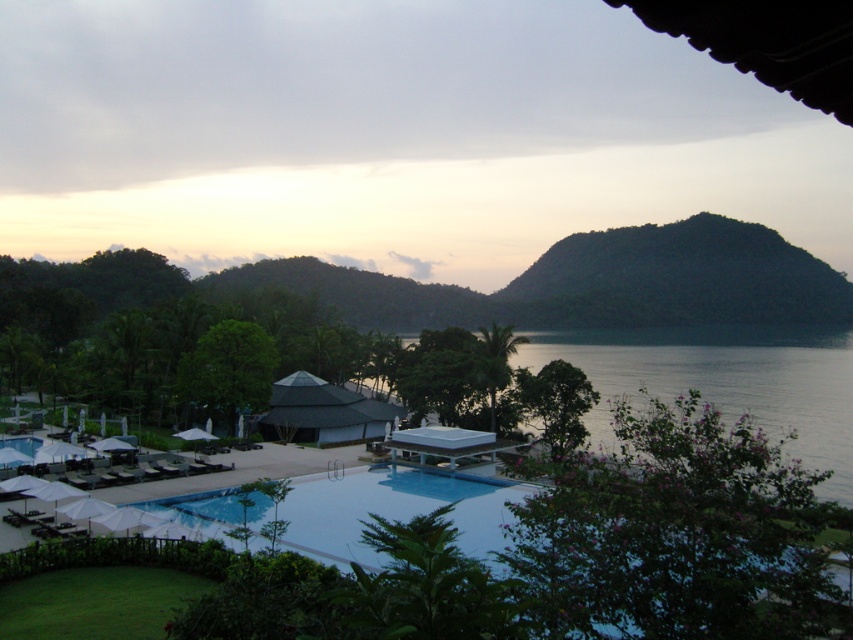
How distant is transparent glass pool at center from transparent glass water at center?

They are 82.93 meters apart.

Is transparent glass pool at center bigger than transparent glass water at center?

No, transparent glass pool at center is not bigger than transparent glass water at center.

At what (x,y) coordinates should I click in order to perform the action: click on transparent glass pool at center. Please return your answer as a coordinate pair (x, y). Image resolution: width=853 pixels, height=640 pixels. Looking at the image, I should click on (711, 508).